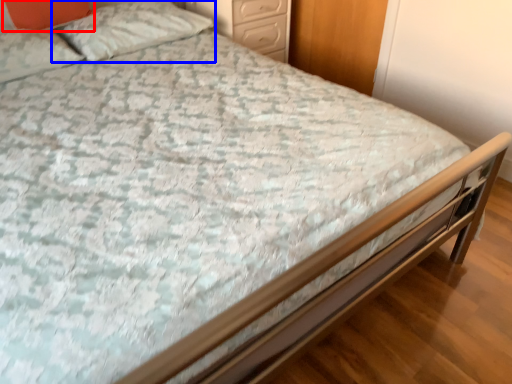
Question: Which object is further to the camera taking this photo, pillow (highlighted by a red box) or pillow (highlighted by a blue box)?

Choices:
 (A) pillow
 (B) pillow

Answer: (B)